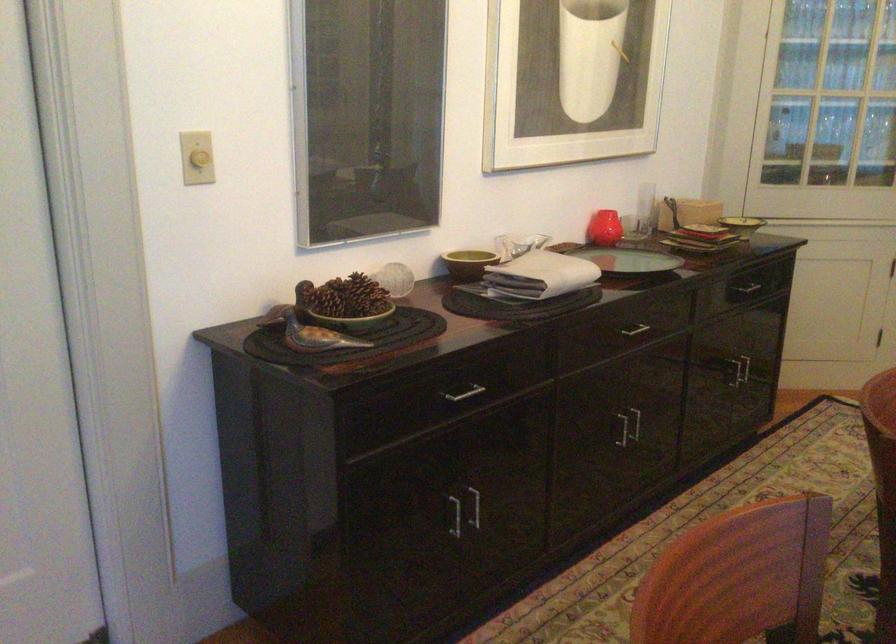
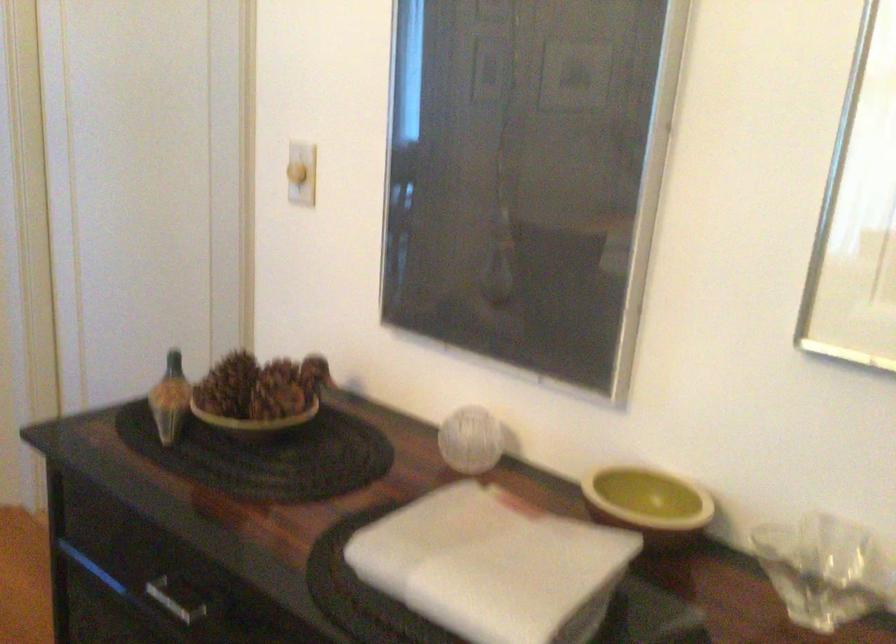
The point at (371, 283) is marked in the first image. Where is the corresponding point in the second image?

(259, 395)